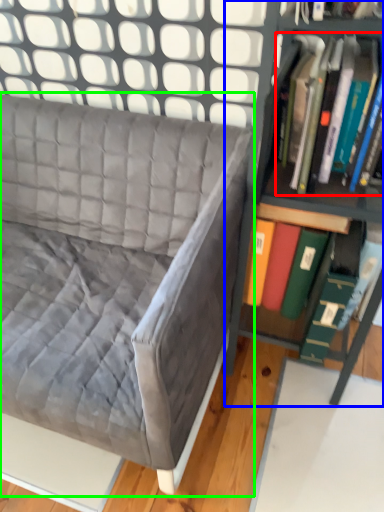
Question: Which object is positioned closest to book (highlighted by a red box)? Select from shelf (highlighted by a blue box) and studio couch (highlighted by a green box).

Choices:
 (A) shelf
 (B) studio couch

Answer: (A)